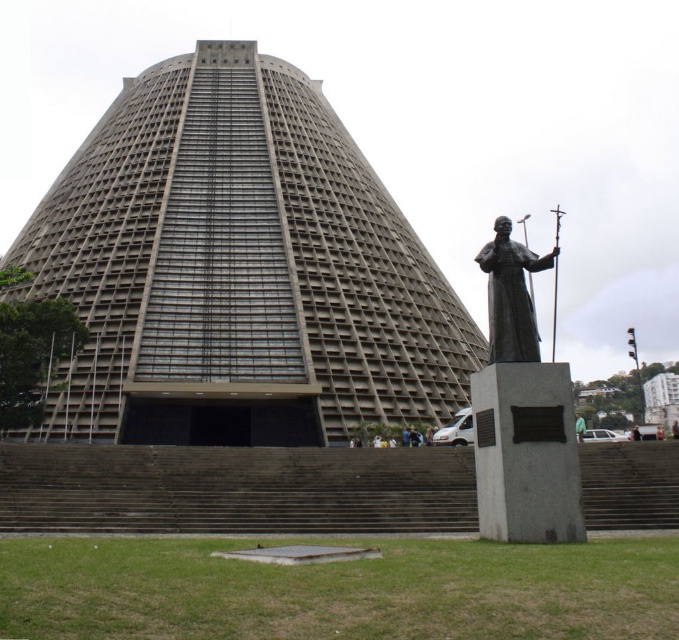
Is point (566, 529) more distant than point (659, 433)?

No.

Between point (483, 492) and point (655, 428), which one is positioned in front?

Positioned in front is point (483, 492).

Is point (496, 461) more distant than point (661, 435)?

No, (496, 461) is closer to viewer.

At what (x,y) coordinates should I click in order to perform the action: click on polished bronze statue at lower right. Please return your answer as a coordinate pair (x, y). The width and height of the screenshot is (679, 640). Looking at the image, I should click on (521, 413).

Is point (445, 355) closer to viewer compared to point (634, 424)?

Yes, point (445, 355) is in front of point (634, 424).

Is point (113, 192) less distant than point (629, 429)?

Yes, point (113, 192) is in front of point (629, 429).

I want to click on gray concrete tower at center, so click(238, 269).

Is point (242, 252) positioned in front of point (576, 429)?

No, (242, 252) is further to viewer.

Identify the location of gray concrete tower at center. The height and width of the screenshot is (640, 679). (238, 269).